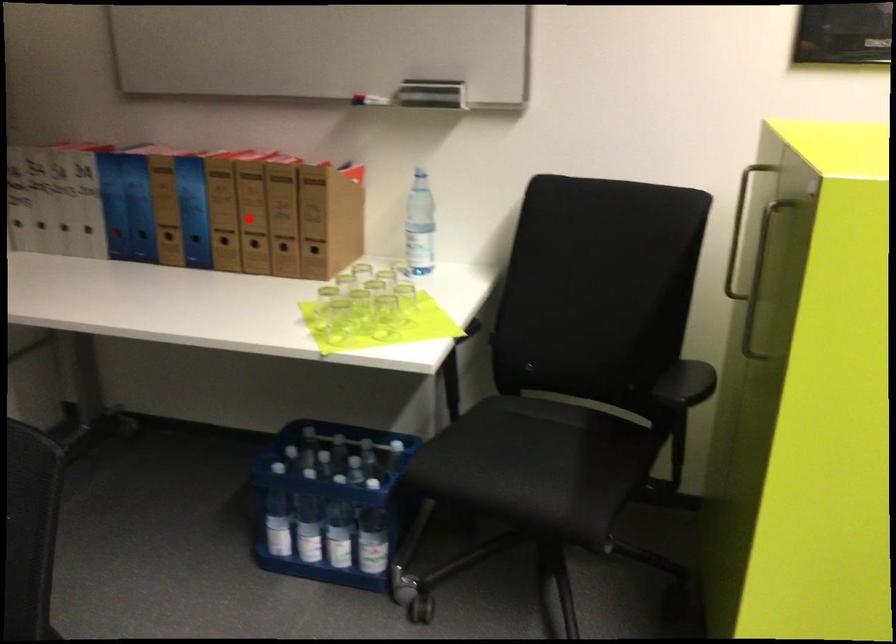
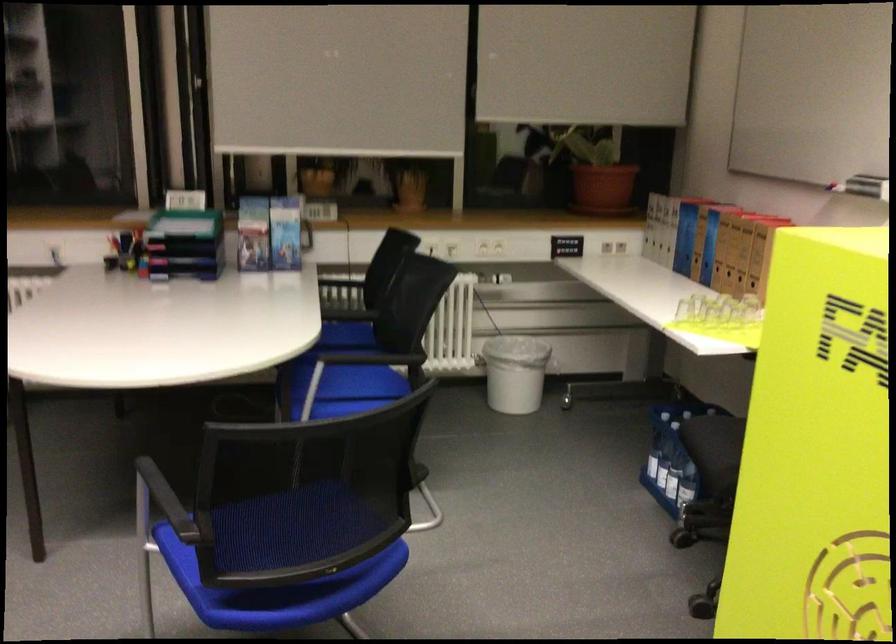
The point at the highlighted location is marked in the first image. Where is the corresponding point in the second image?

(730, 251)